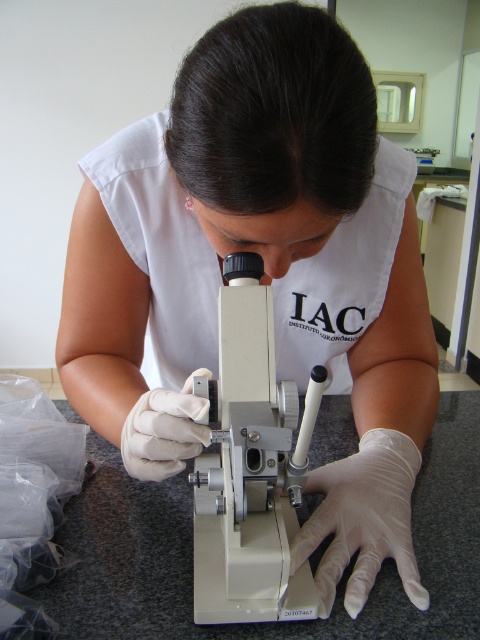
You are a lab technician who needs to adjust the white plastic microscope at center. Since you are wearing the white latex glove at center, can you reach the microscope without moving your hand from its current position?

The white plastic microscope at center is to the left of white latex glove at center, so you can reach the microscope without moving your hand from its current position because it is adjacent to the glove.

In the scene shown: You are a researcher in the lab and need to reach a point marked at coordinates point (351, 573). If your arm can extend 20 inches, can you reach it without moving your chair?

The distance of point (351, 573) from viewer is 21.47 inches, so you cannot reach it with an arm extension of 20 inches without moving your chair.